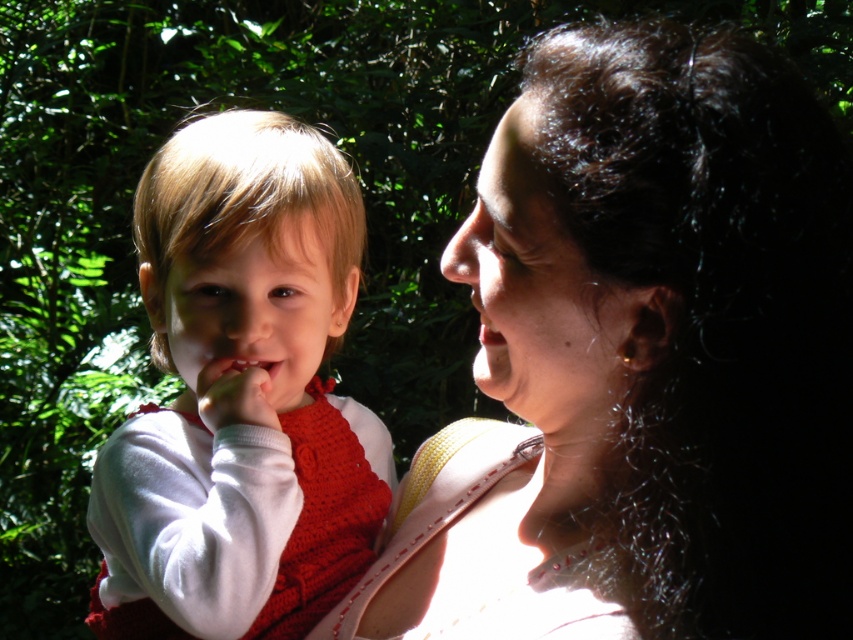
Which is above, white crochet vest at left or matte white teeth at center?

Positioned higher is matte white teeth at center.

Between white crochet vest at left and matte white teeth at center, which one is positioned lower?

white crochet vest at left is lower down.

Does point (321, 488) come in front of point (219, 385)?

No.

This screenshot has height=640, width=853. Identify the location of white crochet vest at left. (239, 397).

Is matte white skin at upper right bigger than matte white teeth at center?

Correct, matte white skin at upper right is larger in size than matte white teeth at center.

Can you confirm if matte white skin at upper right is positioned to the left of matte white teeth at center?

Incorrect, matte white skin at upper right is not on the left side of matte white teeth at center.

What are the coordinates of `matte white skin at upper right` in the screenshot? It's located at (643, 362).

Does smooth skin nose at center appear under matte white teeth at center?

Actually, smooth skin nose at center is above matte white teeth at center.

Is smooth skin nose at center smaller than matte white teeth at center?

No.

Between point (479, 218) and point (215, 369), which one is positioned in front?

Positioned in front is point (479, 218).

Where is `smooth skin nose at center`? smooth skin nose at center is located at coordinates (468, 248).